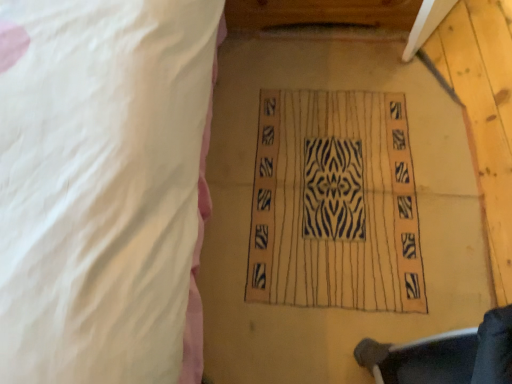
I want to click on free spot behind zebra-patterned fabric at center, so click(x=322, y=58).